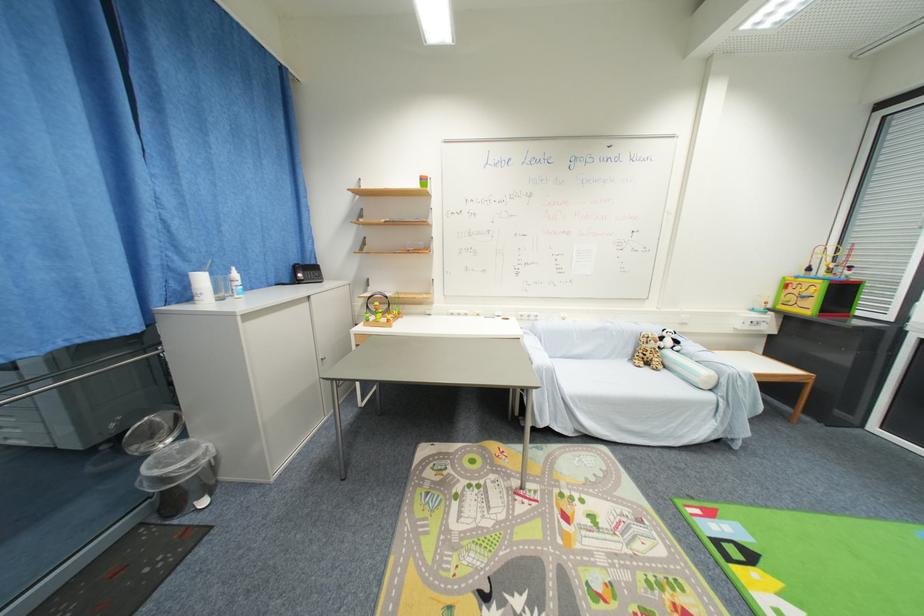
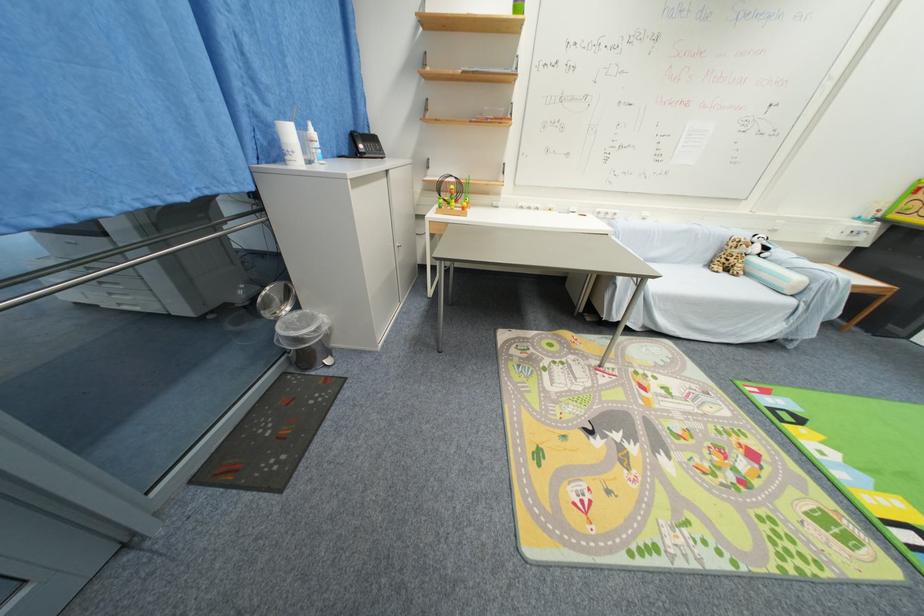
Find the pixel in the second image that matches [638,361] in the first image.

(714, 265)